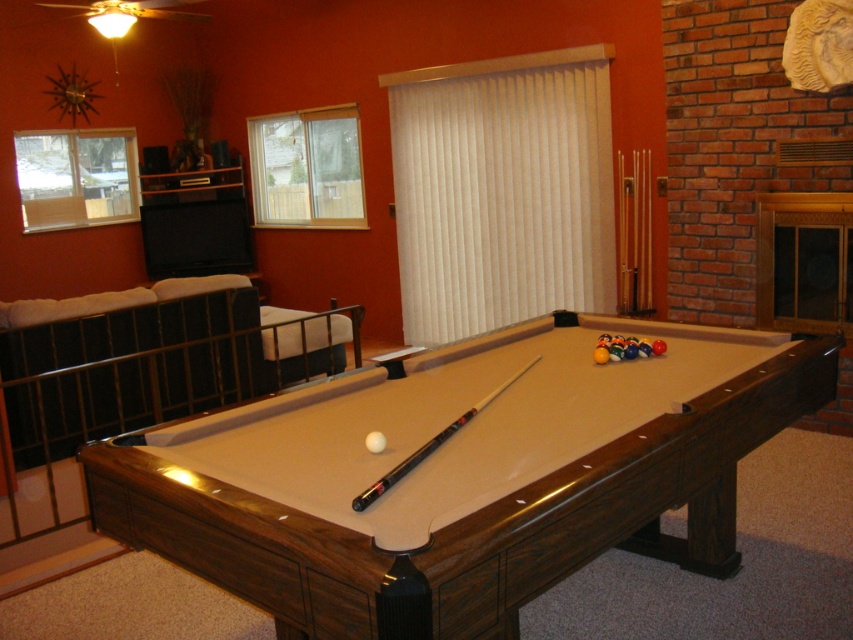
How much distance is there between brown wood billiard table at center and black wood pool cue at center?

brown wood billiard table at center and black wood pool cue at center are 15.30 inches apart.

Which is below, brown wood billiard table at center or black wood pool cue at center?

Positioned lower is brown wood billiard table at center.

What do you see at coordinates (461, 476) in the screenshot? I see `brown wood billiard table at center` at bounding box center [461, 476].

At what (x,y) coordinates should I click in order to perform the action: click on brown wood billiard table at center. Please return your answer as a coordinate pair (x, y). The width and height of the screenshot is (853, 640). Looking at the image, I should click on (461, 476).